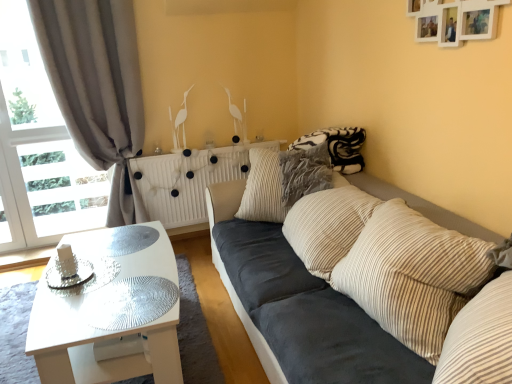
Question: Should I look upward or downward to see white glossy coffee table at lower left?

Choices:
 (A) up
 (B) down

Answer: (B)

Question: Can you see striped corduroy pillow at center, which is the second pillow from back to front, touching white glossy coffee table at lower left?

Choices:
 (A) no
 (B) yes

Answer: (A)

Question: From a real-world perspective, is striped corduroy pillow at center, marked as the first pillow in a front-to-back arrangement, below white glossy coffee table at lower left?

Choices:
 (A) yes
 (B) no

Answer: (B)

Question: Is white glossy coffee table at lower left surrounded by striped corduroy pillow at center, which is the second pillow from back to front?

Choices:
 (A) no
 (B) yes

Answer: (A)

Question: From the image's perspective, is striped corduroy pillow at center, marked as the first pillow in a front-to-back arrangement, below white glossy coffee table at lower left?

Choices:
 (A) yes
 (B) no

Answer: (B)

Question: Is striped corduroy pillow at center, which is the second pillow from back to front, smaller than white glossy coffee table at lower left?

Choices:
 (A) no
 (B) yes

Answer: (B)

Question: Does striped corduroy pillow at center, which is the second pillow from back to front, appear on the left side of white glossy coffee table at lower left?

Choices:
 (A) no
 (B) yes

Answer: (A)

Question: Is transparent glass table at lower left beside dark blue fabric couch at center?

Choices:
 (A) yes
 (B) no

Answer: (B)

Question: From a real-world perspective, is transparent glass table at lower left physically below dark blue fabric couch at center?

Choices:
 (A) no
 (B) yes

Answer: (A)

Question: Considering the relative sizes of transparent glass table at lower left and dark blue fabric couch at center in the image provided, is transparent glass table at lower left taller than dark blue fabric couch at center?

Choices:
 (A) yes
 (B) no

Answer: (B)

Question: Is transparent glass table at lower left aimed at dark blue fabric couch at center?

Choices:
 (A) no
 (B) yes

Answer: (A)

Question: Is dark blue fabric couch at center located within transparent glass table at lower left?

Choices:
 (A) no
 (B) yes

Answer: (A)

Question: From the image's perspective, does transparent glass table at lower left appear lower than dark blue fabric couch at center?

Choices:
 (A) no
 (B) yes

Answer: (B)

Question: Is striped corduroy pillow at center, marked as the first pillow in a front-to-back arrangement, wider than transparent glass table at lower left?

Choices:
 (A) yes
 (B) no

Answer: (B)